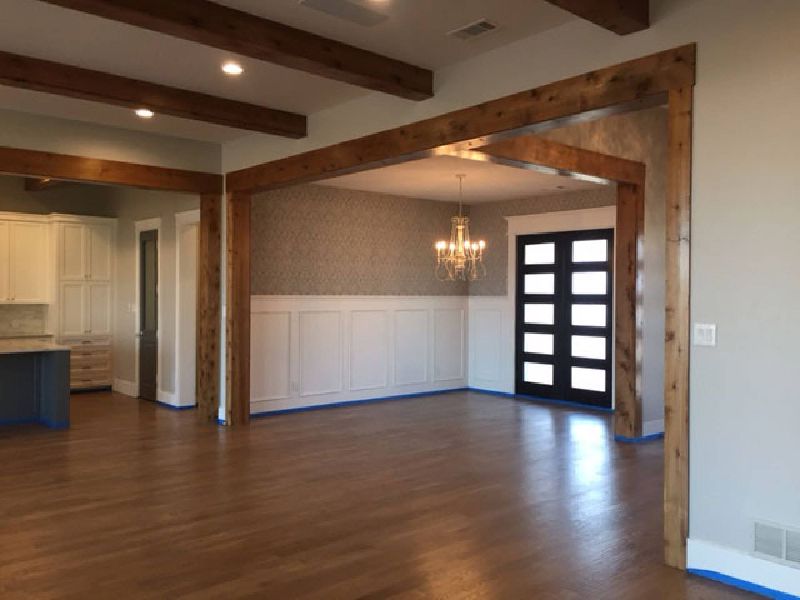
Locate an element on the screen. vent is located at coordinates (776, 546).